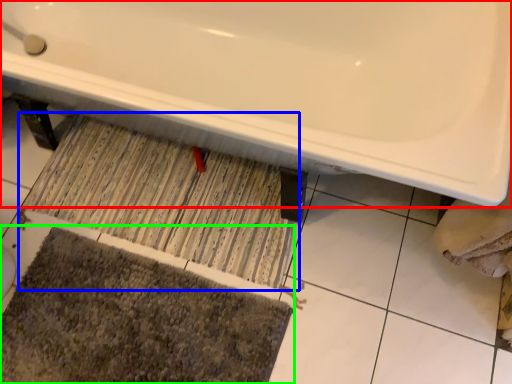
Question: Based on their relative distances, which object is farther from bathtub (highlighted by a red box)? Choose from doormat (highlighted by a blue box) and bath mat (highlighted by a green box).

Choices:
 (A) doormat
 (B) bath mat

Answer: (B)